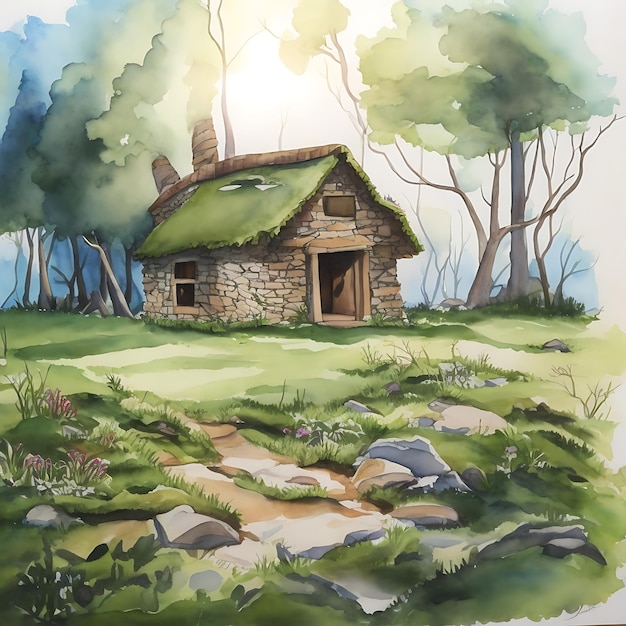
Where is `door`? Image resolution: width=626 pixels, height=626 pixels. door is located at coordinates click(x=347, y=288).